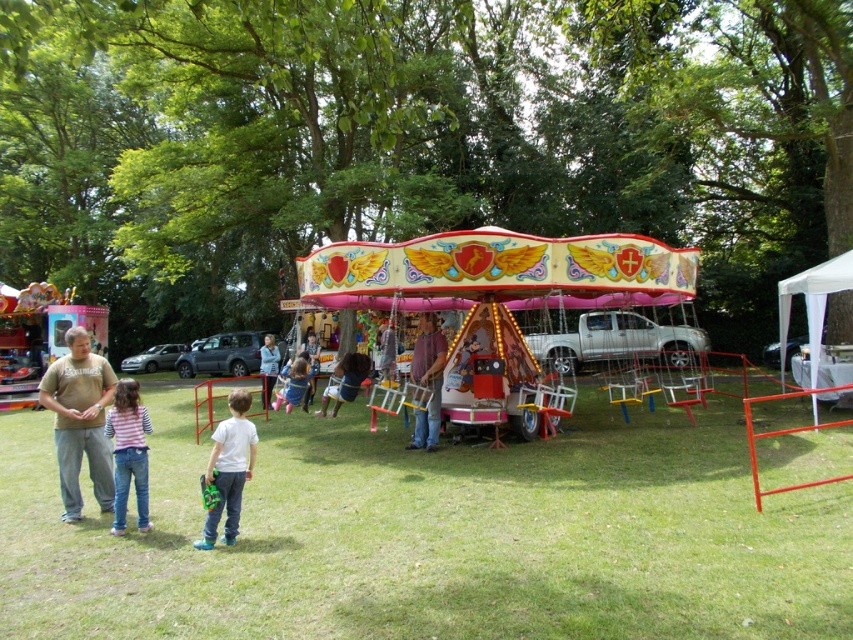
Question: Does glossy plastic carousel at center have a smaller size compared to white fabric canopy at right?

Choices:
 (A) no
 (B) yes

Answer: (B)

Question: Does white matte shirt at lower left appear on the left side of matte pink dress at center?

Choices:
 (A) no
 (B) yes

Answer: (A)

Question: Which object is the farthest from the metallic carousel at center?

Choices:
 (A) light blue denim jeans at center
 (B) matte pink swing at center
 (C) brown cotton shirt at left

Answer: (B)

Question: Which of the following is the closest to the observer?

Choices:
 (A) brown cotton shirt at left
 (B) light blue denim jeans at center
 (C) white fabric canopy at right

Answer: (A)

Question: Can you confirm if metallic carousel at center is smaller than white fabric canopy at right?

Choices:
 (A) no
 (B) yes

Answer: (B)

Question: Which is nearer to the white fabric canopy at right?

Choices:
 (A) shiny metallic carousel at center
 (B) white matte shirt at lower left
 (C) matte pink swing at center

Answer: (A)